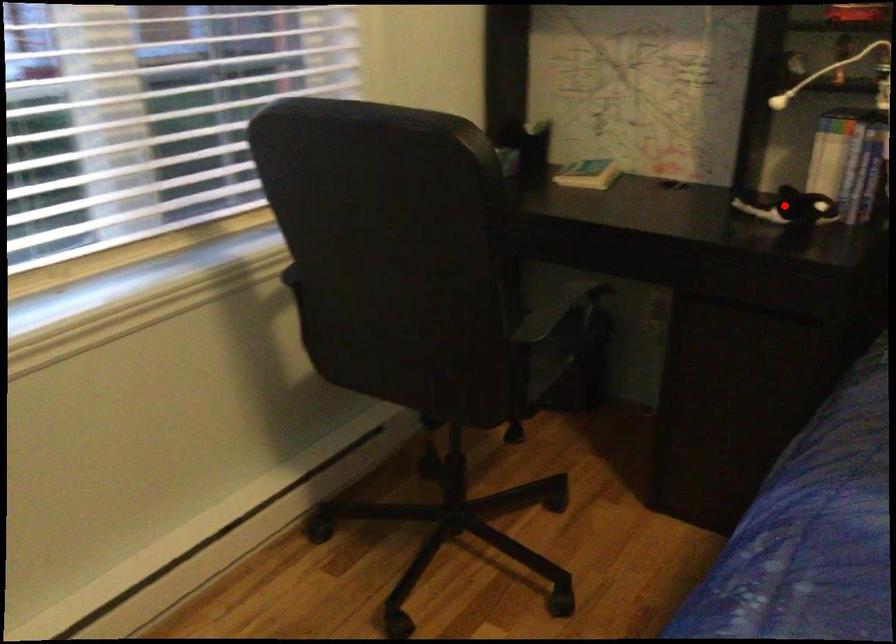
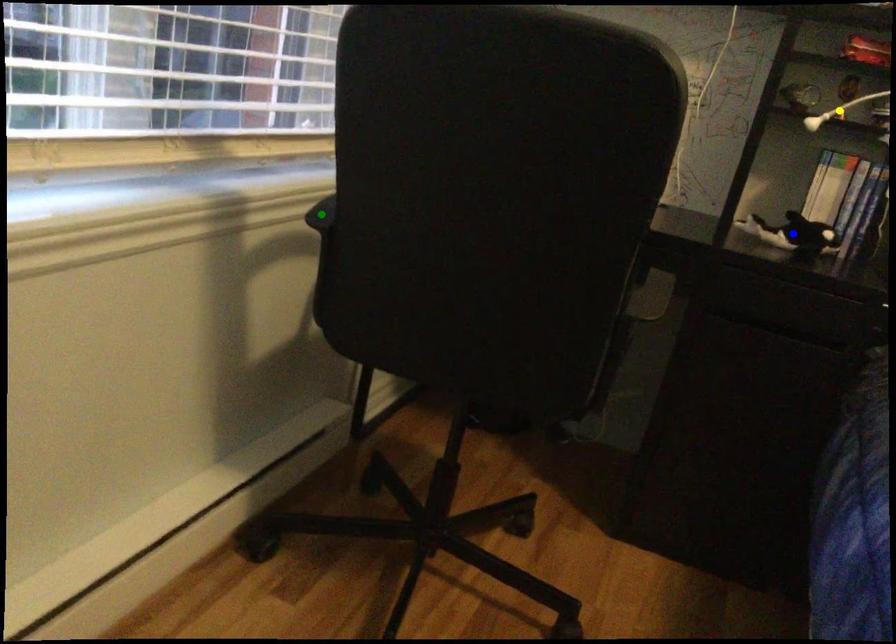
Question: I am providing you with two images of the same scene from different viewpoints. A red point is marked on the first image. You are given multiple points on the second image. In image 2, which mark is for the same physical point as the one in image 1?

Choices:
 (A) blue point
 (B) green point
 (C) yellow point

Answer: (A)